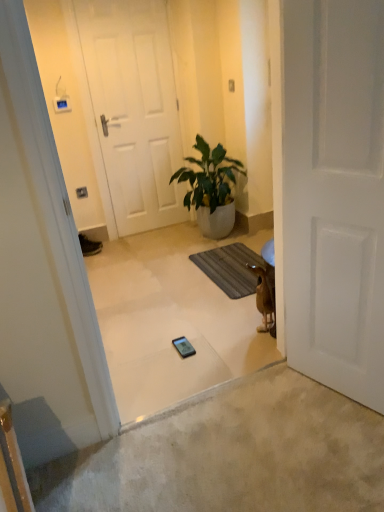
Identify the location of free space in front of white matte door at right, which appears as the 1th door when viewed from the right. Image resolution: width=384 pixels, height=512 pixels. (338, 436).